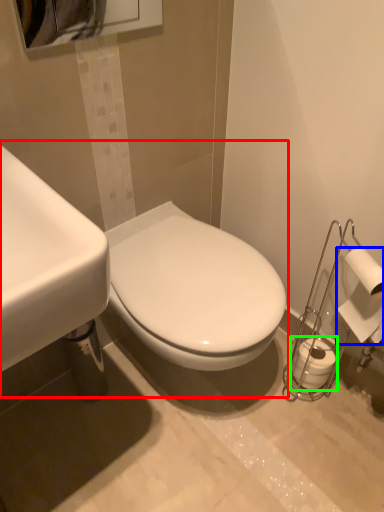
Question: Considering the real-world distances, which object is closest to sink (highlighted by a red box)? toilet paper (highlighted by a blue box) or toilet paper (highlighted by a green box).

Choices:
 (A) toilet paper
 (B) toilet paper

Answer: (A)